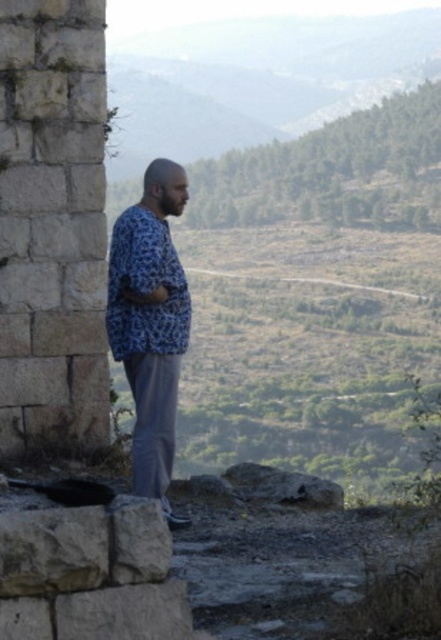
You are planning to paint a mural on the white stone wall at left and the blue printed shirt at center. Which object requires a larger canvas based on their sizes?

The blue printed shirt at center requires a larger canvas than the white stone wall at left because the white stone wall at left is smaller than the blue printed shirt at center.

You are a photographer trying to capture the man in the blue printed shirt at center while ensuring the white stone wall at left is visible in the background. Based on their positions, can you determine if the wall will be visible behind the man in the photo?

The white stone wall at left is located above the blue printed shirt at center, so if the camera is positioned to include the upper part of the scene where the wall is situated, the wall will be visible behind the man in the photo.

You are standing in the scenic landscape and see the white stone wall at left and the blue printed shirt at center. Which object is positioned to the left of the other?

The white stone wall at left is to the left of the blue printed shirt at center.